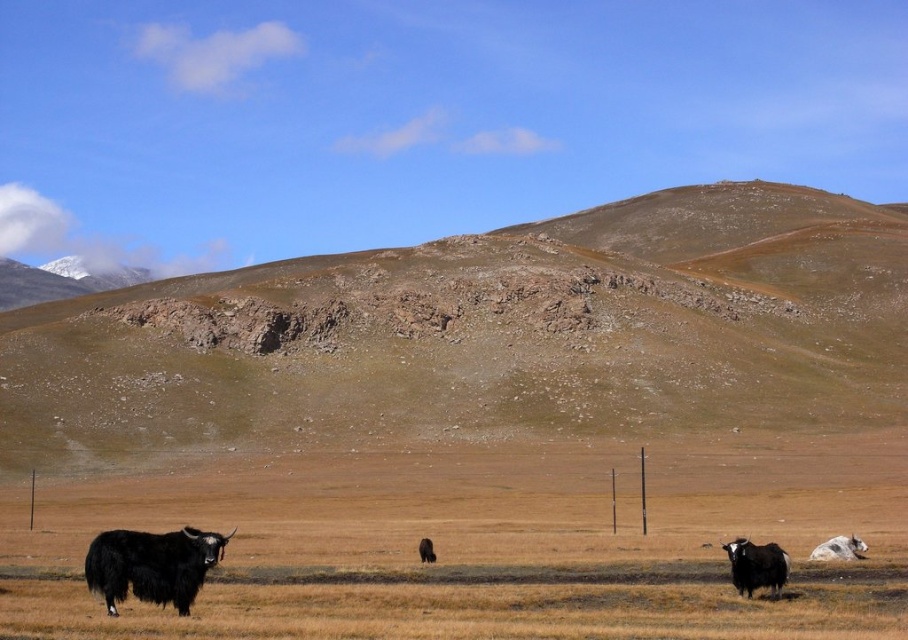
Question: Does black fuzzy bison at lower right lie behind white woolen yak at lower right?

Choices:
 (A) no
 (B) yes

Answer: (A)

Question: Which object is the closest to the white woolen yak at lower right?

Choices:
 (A) black fuzzy bison at lower right
 (B) black fuzzy bison at lower left
 (C) black fuzzy yak at center
 (D) brown rocky mountain at center

Answer: (A)

Question: Which of the following is the farthest from the observer?

Choices:
 (A) black fuzzy bison at lower left
 (B) white woolen yak at lower right
 (C) black fuzzy yak at center

Answer: (B)

Question: Can you confirm if black fuzzy bison at lower left is thinner than white woolen yak at lower right?

Choices:
 (A) yes
 (B) no

Answer: (B)

Question: Is white woolen yak at lower right to the right of black fuzzy yak at center from the viewer's perspective?

Choices:
 (A) no
 (B) yes

Answer: (B)

Question: Based on their relative distances, which object is nearer to the black fuzzy bison at lower left?

Choices:
 (A) brown rocky mountain at center
 (B) white woolen yak at lower right
 (C) black fuzzy yak at center

Answer: (C)